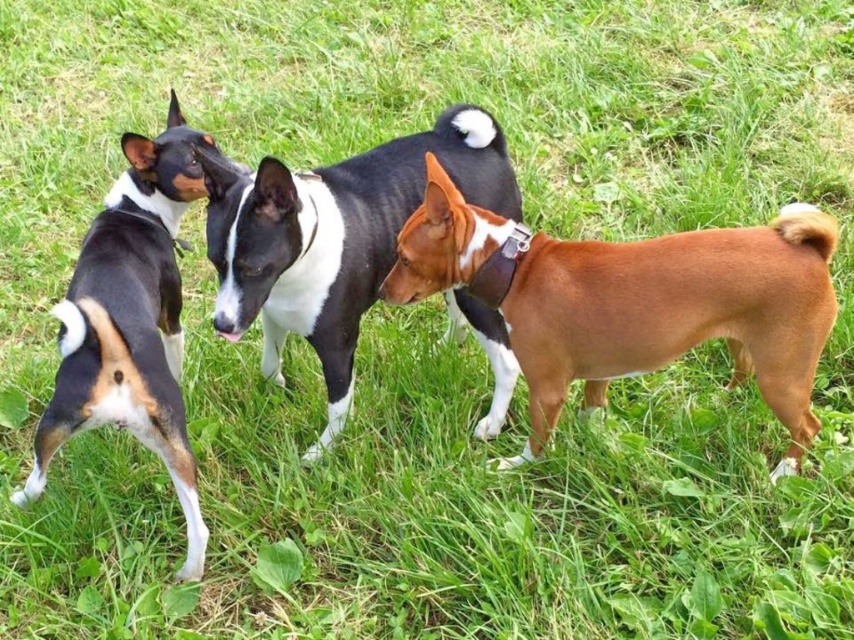
Question: Which object is positioned closest to the brown leather collar at center?

Choices:
 (A) brown leather dog at center
 (B) brown leather neckband at center
 (C) black and white fur at left

Answer: (C)

Question: Is black and white fur at left positioned at the back of brown leather neckband at center?

Choices:
 (A) no
 (B) yes

Answer: (A)

Question: Considering the relative positions of brown leather dog at center and black and white fur at left in the image provided, where is brown leather dog at center located with respect to black and white fur at left?

Choices:
 (A) right
 (B) left

Answer: (A)

Question: Which point appears farthest from the camera in this image?

Choices:
 (A) (518, 256)
 (B) (124, 362)
 (C) (498, 348)
 (D) (494, 234)

Answer: (C)

Question: Can you confirm if brown leather dog at center is thinner than brown leather collar at center?

Choices:
 (A) yes
 (B) no

Answer: (B)

Question: Estimate the real-world distances between objects in this image. Which object is farther from the brown leather collar at center?

Choices:
 (A) brown leather neckband at center
 (B) brown leather dog at center
 (C) black and white fur at left

Answer: (B)